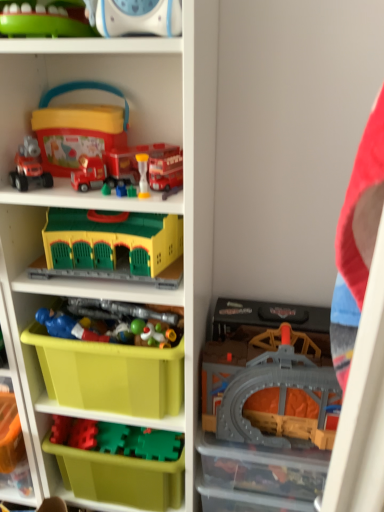
At what (x,y) coordinates should I click in order to perform the action: click on translucent plastic toy at center, the 2th toy when ordered from bottom to top. Please return your answer as a coordinate pair (x, y). Looking at the image, I should click on (153, 334).

Describe the element at coordinates (68, 327) in the screenshot. The height and width of the screenshot is (512, 384). I see `blue plastic figure at center, the fifth toy from the top` at that location.

You are a GUI agent. You are given a task and a screenshot of the screen. Output one action in this format:
    pyautogui.click(x=<x>, y=<y>)
    Task: Click on the blue plastic figure at center, the fifth toy from the top
    The height and width of the screenshot is (512, 384).
    Given the screenshot: What is the action you would take?
    [x=68, y=327]

The height and width of the screenshot is (512, 384). Describe the element at coordinates (143, 175) in the screenshot. I see `translucent plastic hourglass at upper center, the sixth toy ordered from the bottom` at that location.

What do you see at coordinates (112, 248) in the screenshot?
I see `yellow plastic building at center, the 3th toy in the top-to-bottom sequence` at bounding box center [112, 248].

Where is `yellow plastic building at center, which ranks as the fifth toy in bottom-to-top order`? The image size is (384, 512). yellow plastic building at center, which ranks as the fifth toy in bottom-to-top order is located at coordinates click(x=112, y=248).

Locate an element on the screen. The width and height of the screenshot is (384, 512). gray plastic train track at center-right, which is the 1th toy in bottom-to-top order is located at coordinates (285, 401).

You are a GUI agent. You are given a task and a screenshot of the screen. Output one action in this format:
    pyautogui.click(x=<x>, y=<y>)
    Task: Click on the translucent plastic toy at center, the 2th toy when ordered from bottom to top
    This screenshot has width=384, height=512.
    Given the screenshot: What is the action you would take?
    pyautogui.click(x=153, y=334)

Choose the correct answer: Is translucent plastic hourglass at upper center, the sixth toy ordered from the bottom, inside blue plastic figure at center, the fifth toy from the top, or outside it?

translucent plastic hourglass at upper center, the sixth toy ordered from the bottom, is outside blue plastic figure at center, the fifth toy from the top.

Identify the location of the 3rd toy above the blue plastic figure at center, positioned as the third toy in bottom-to-top order (from the image's perspective). (143, 175).

Can you confirm if translucent plastic hourglass at upper center, the sixth toy ordered from the bottom, is shorter than blue plastic figure at center, the fifth toy from the top?

Incorrect, the height of translucent plastic hourglass at upper center, the sixth toy ordered from the bottom, does not fall short of that of blue plastic figure at center, the fifth toy from the top.

Is gray plastic train track at center-right, which is the 1th toy in bottom-to-top order, positioned beyond the bounds of yellow plastic building at center, which ranks as the fifth toy in bottom-to-top order?

Indeed, gray plastic train track at center-right, which is the 1th toy in bottom-to-top order, is completely outside yellow plastic building at center, which ranks as the fifth toy in bottom-to-top order.

Is gray plastic train track at center-right, which is the 1th toy in bottom-to-top order, bigger than yellow plastic building at center, the 3th toy in the top-to-bottom sequence?

Yes.

Is gray plastic train track at center-right, which is counted as the 7th toy, starting from the top, wider than yellow plastic building at center, which ranks as the fifth toy in bottom-to-top order?

No, gray plastic train track at center-right, which is counted as the 7th toy, starting from the top, is not wider than yellow plastic building at center, which ranks as the fifth toy in bottom-to-top order.

At what (x,y) coordinates should I click in order to perform the action: click on the 1st toy behind the gray plastic train track at center-right, which is counted as the 7th toy, starting from the top, counting from the anchor's position. Please return your answer as a coordinate pair (x, y). Looking at the image, I should click on (112, 248).

Is point (108, 306) closer to camera compared to point (107, 337)?

No, it is not.

From the image's perspective, is translucent plastic toy at center, acting as the 4th toy starting from the bottom, above or below blue plastic figure at center, positioned as the third toy in bottom-to-top order?

From the image's perspective, translucent plastic toy at center, acting as the 4th toy starting from the bottom, appears above blue plastic figure at center, positioned as the third toy in bottom-to-top order.

Is translucent plastic toy at center, which appears as the 4th toy when viewed from the top, next to blue plastic figure at center, the fifth toy from the top, and touching it?

Indeed, translucent plastic toy at center, which appears as the 4th toy when viewed from the top, and blue plastic figure at center, the fifth toy from the top, are beside each other and touching.

Does blue plastic figure at center, the fifth toy from the top, have a lesser height compared to green plastic storage box at lower center, which is counted as the 2th storage box, starting from the right?

Yes.

Between blue plastic figure at center, positioned as the third toy in bottom-to-top order, and green plastic storage box at lower center, which ranks as the 1th storage box in left-to-right order, which one has larger size?

With larger size is green plastic storage box at lower center, which ranks as the 1th storage box in left-to-right order.

Does point (84, 340) lie behind point (129, 442)?

No, (84, 340) is closer to viewer.

From the image's perspective, is blue plastic figure at center, positioned as the third toy in bottom-to-top order, under green plastic storage box at lower center, which is counted as the 2th storage box, starting from the right?

A: No.

Looking at their sizes, would you say yellow plastic building at center, which ranks as the fifth toy in bottom-to-top order, is wider or thinner than translucent plastic toy at center, the sixth toy in the top-to-bottom sequence?

yellow plastic building at center, which ranks as the fifth toy in bottom-to-top order, is wider than translucent plastic toy at center, the sixth toy in the top-to-bottom sequence.

From the image's perspective, is yellow plastic building at center, which ranks as the fifth toy in bottom-to-top order, above or below translucent plastic toy at center, the sixth toy in the top-to-bottom sequence?

yellow plastic building at center, which ranks as the fifth toy in bottom-to-top order, is above translucent plastic toy at center, the sixth toy in the top-to-bottom sequence.

Between yellow plastic building at center, the 3th toy in the top-to-bottom sequence, and translucent plastic toy at center, the 2th toy when ordered from bottom to top, which one appears on the right side from the viewer's perspective?

Positioned to the right is translucent plastic toy at center, the 2th toy when ordered from bottom to top.

Looking at their sizes, would you say green plastic storage box at lower center, which is counted as the 2th storage box, starting from the right, is wider or thinner than yellow plastic building at center, which ranks as the fifth toy in bottom-to-top order?

In the image, green plastic storage box at lower center, which is counted as the 2th storage box, starting from the right, appears to be wider than yellow plastic building at center, which ranks as the fifth toy in bottom-to-top order.

Is green plastic storage box at lower center, which ranks as the 1th storage box in left-to-right order, completely or partially outside of yellow plastic building at center, the 3th toy in the top-to-bottom sequence?

green plastic storage box at lower center, which ranks as the 1th storage box in left-to-right order, lies outside yellow plastic building at center, the 3th toy in the top-to-bottom sequence,'s area.

Considering the relative sizes of green plastic storage box at lower center, which ranks as the 1th storage box in left-to-right order, and yellow plastic building at center, which ranks as the fifth toy in bottom-to-top order, in the image provided, is green plastic storage box at lower center, which ranks as the 1th storage box in left-to-right order, bigger than yellow plastic building at center, which ranks as the fifth toy in bottom-to-top order,?

Yes, green plastic storage box at lower center, which ranks as the 1th storage box in left-to-right order, is bigger than yellow plastic building at center, which ranks as the fifth toy in bottom-to-top order.

Can you see green plastic storage box at lower center, which is counted as the 2th storage box, starting from the right, touching yellow plastic building at center, which ranks as the fifth toy in bottom-to-top order?

No, green plastic storage box at lower center, which is counted as the 2th storage box, starting from the right, is not in contact with yellow plastic building at center, which ranks as the fifth toy in bottom-to-top order.

Is point (39, 157) closer or farther from the camera than point (291, 467)?

Point (39, 157).

Which object is thinner, matte red truck at upper left, arranged as the 1th toy when viewed from the top, or translucent plastic tunnel at lower right, which is counted as the first storage box, starting from the right?

matte red truck at upper left, arranged as the 1th toy when viewed from the top, is thinner.

From the image's perspective, which object appears higher, matte red truck at upper left, the seventh toy when ordered from bottom to top, or translucent plastic tunnel at lower right, which is counted as the first storage box, starting from the right?

matte red truck at upper left, the seventh toy when ordered from bottom to top, appears higher in the image.

This screenshot has width=384, height=512. There is a translucent plastic tunnel at lower right, which is counted as the first storage box, starting from the right. What are the coordinates of `the 7th toy above it (from a real-world perspective)` in the screenshot? It's located at (29, 167).

From the image's perspective, count 3rd toys downward from the translucent plastic hourglass at upper center, acting as the second toy starting from the top, and point to it. Please provide its 2D coordinates.

[(68, 327)]

Which toy is the 1st one when counting from the back of the gray plastic train track at center-right, which is the 1th toy in bottom-to-top order? Please provide its 2D coordinates.

[(112, 248)]

Estimate the real-world distances between objects in this image. Which object is further from matte red truck at upper left, the seventh toy when ordered from bottom to top, gray plastic train track at center-right, which is the 1th toy in bottom-to-top order, or translucent plastic toy at center, the sixth toy in the top-to-bottom sequence?

Based on the image, gray plastic train track at center-right, which is the 1th toy in bottom-to-top order, appears to be further to matte red truck at upper left, the seventh toy when ordered from bottom to top.

When comparing their distances from yellow plastic building at center, the 3th toy in the top-to-bottom sequence, does translucent plastic toy at center, the sixth toy in the top-to-bottom sequence, or translucent plastic hourglass at upper center, acting as the second toy starting from the top, seem further?

Among the two, translucent plastic toy at center, the sixth toy in the top-to-bottom sequence, is located further to yellow plastic building at center, the 3th toy in the top-to-bottom sequence.

Consider the image. Which object lies nearer to the anchor point green plastic storage box at lower center, which ranks as the 1th storage box in left-to-right order, gray plastic train track at center-right, which is the 1th toy in bottom-to-top order, or translucent plastic toy at center, the 2th toy when ordered from bottom to top?

gray plastic train track at center-right, which is the 1th toy in bottom-to-top order.

Estimate the real-world distances between objects in this image. Which object is closer to matte red truck at upper left, arranged as the 1th toy when viewed from the top, translucent plastic tunnel at lower right, which is counted as the first storage box, starting from the right, or gray plastic train track at center-right, which is counted as the 7th toy, starting from the top?

gray plastic train track at center-right, which is counted as the 7th toy, starting from the top, is positioned closer to the anchor matte red truck at upper left, arranged as the 1th toy when viewed from the top.

Which object lies nearer to the anchor point gray plastic train track at center-right, which is counted as the 7th toy, starting from the top, translucent plastic toy at center, acting as the 4th toy starting from the bottom, or yellow plastic building at center, which ranks as the fifth toy in bottom-to-top order?

translucent plastic toy at center, acting as the 4th toy starting from the bottom, is closer to gray plastic train track at center-right, which is counted as the 7th toy, starting from the top.

Looking at the image, which one is located closer to green plastic bin at lower left, matte red truck at upper left, the seventh toy when ordered from bottom to top, or green plastic storage box at lower center, which ranks as the 1th storage box in left-to-right order?

Among the two, green plastic storage box at lower center, which ranks as the 1th storage box in left-to-right order, is located nearer to green plastic bin at lower left.

Considering their positions, is green plastic storage box at lower center, which is counted as the 2th storage box, starting from the right, positioned further to translucent plastic toy at center, the 2th toy when ordered from bottom to top, than green plastic bin at lower left?

green plastic bin at lower left is positioned further to the anchor translucent plastic toy at center, the 2th toy when ordered from bottom to top.

Based on their spatial positions, is translucent plastic toy at center, the 2th toy when ordered from bottom to top, or green plastic storage box at lower center, which is counted as the 2th storage box, starting from the right, closer to yellow plastic building at center, the 3th toy in the top-to-bottom sequence?

translucent plastic toy at center, the 2th toy when ordered from bottom to top, lies closer to yellow plastic building at center, the 3th toy in the top-to-bottom sequence, than the other object.

You are a GUI agent. You are given a task and a screenshot of the screen. Output one action in this format:
    pyautogui.click(x=<x>, y=<y>)
    Task: Click on the toy between translucent plastic toy at center, the sixth toy in the top-to-bottom sequence, and translucent plastic tunnel at lower right, positioned as the second storage box in left-to-right order, in the horizontal direction
    This screenshot has width=384, height=512.
    Given the screenshot: What is the action you would take?
    pyautogui.click(x=285, y=401)

At what (x,y) coordinates should I click in order to perform the action: click on storage box between blue plastic figure at center, the fifth toy from the top, and translucent plastic tunnel at lower right, positioned as the second storage box in left-to-right order, from left to right. Please return your answer as a coordinate pair (x, y). Looking at the image, I should click on (119, 462).

The width and height of the screenshot is (384, 512). Find the location of `storage box between matte red truck at upper left, arranged as the 1th toy when viewed from the top, and green plastic storage box at lower center, which ranks as the 1th storage box in left-to-right order, in the vertical direction`. storage box between matte red truck at upper left, arranged as the 1th toy when viewed from the top, and green plastic storage box at lower center, which ranks as the 1th storage box in left-to-right order, in the vertical direction is located at coordinates (264, 472).

You are a GUI agent. You are given a task and a screenshot of the screen. Output one action in this format:
    pyautogui.click(x=<x>, y=<y>)
    Task: Click on the storage box located between green plastic bin at lower left and gray plastic train track at center-right, which is the 1th toy in bottom-to-top order, in the left-right direction
    The image size is (384, 512).
    Given the screenshot: What is the action you would take?
    pyautogui.click(x=119, y=462)